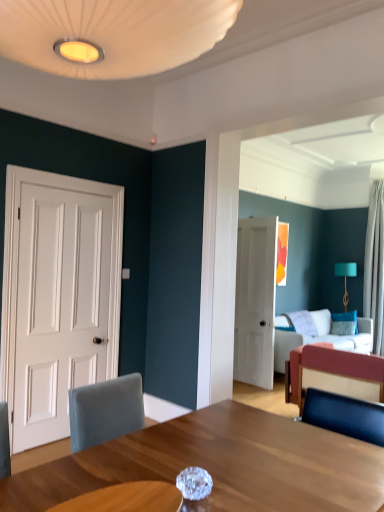
Identify the location of free spot above white matte door at left, placed as the 2th door when sorted from back to front (from a real-world perspective). (75, 175).